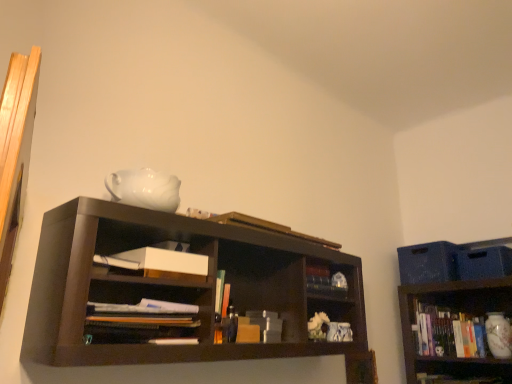
Question: Does point (470, 324) appear closer or farther from the camera than point (236, 223)?

Choices:
 (A) closer
 (B) farther

Answer: (B)

Question: Is white glossy vase at lower right, acting as the 1th book starting from the right, in front of or behind gold metallic book at upper center, acting as the 1th book starting from the top, in the image?

Choices:
 (A) behind
 (B) front

Answer: (A)

Question: Estimate the real-world distances between objects in this image. Which object is farther from the white matte paper at center?

Choices:
 (A) matte white vase at lower right
 (B) gold metallic book at upper center, acting as the 1th book starting from the top
 (C) white glossy vase at lower right, the 3th book viewed from the left
 (D) white paper at center, positioned as the 2th book in bottom-to-top order

Answer: (A)

Question: Based on their relative distances, which object is farther from the matte white vase at lower right?

Choices:
 (A) white matte paper at center
 (B) white paper at center, marked as the 3th book in a right-to-left arrangement
 (C) white glossy vase at lower right, the 1th book ordered from the bottom
 (D) gold metallic book at upper center, the second book in the right-to-left sequence

Answer: (B)